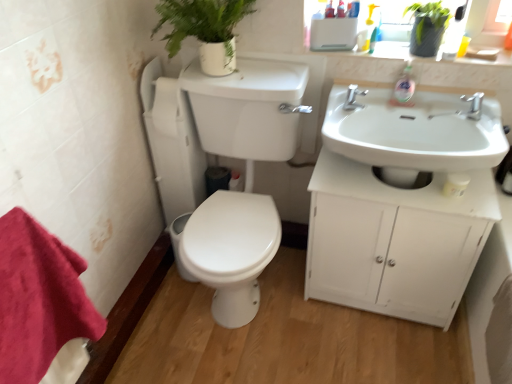
Question: Considering the relative sizes of green matte plant at upper center, which is the 2th plant from right to left, and green matte plant at upper right, the first plant positioned from the right, in the image provided, is green matte plant at upper center, which is the 2th plant from right to left, thinner than green matte plant at upper right, the first plant positioned from the right,?

Choices:
 (A) no
 (B) yes

Answer: (A)

Question: Is green matte plant at upper center, which is the 2th plant from right to left, to the right of green matte plant at upper right, the first plant positioned from the right, from the viewer's perspective?

Choices:
 (A) yes
 (B) no

Answer: (B)

Question: Are green matte plant at upper center, the 1th plant when ordered from left to right, and green matte plant at upper right, the first plant positioned from the right, beside each other?

Choices:
 (A) no
 (B) yes

Answer: (A)

Question: Is green matte plant at upper center, the 1th plant when ordered from left to right, far away from green matte plant at upper right, the first plant positioned from the right?

Choices:
 (A) no
 (B) yes

Answer: (A)

Question: From a real-world perspective, is green matte plant at upper center, which is the 2th plant from right to left, under green matte plant at upper right, the first plant positioned from the right?

Choices:
 (A) yes
 (B) no

Answer: (A)

Question: Is white glossy toilet at center-left to the left or to the right of red cotton towel at lower left in the image?

Choices:
 (A) left
 (B) right

Answer: (B)

Question: Considering the positions of white glossy toilet at center-left and red cotton towel at lower left in the image, is white glossy toilet at center-left bigger or smaller than red cotton towel at lower left?

Choices:
 (A) big
 (B) small

Answer: (A)

Question: From the image's perspective, is white glossy toilet at center-left located above or below red cotton towel at lower left?

Choices:
 (A) above
 (B) below

Answer: (A)

Question: Considering their positions, is white glossy toilet at center-left located in front of or behind red cotton towel at lower left?

Choices:
 (A) front
 (B) behind

Answer: (B)

Question: From a real-world perspective, relative to silver metallic faucet at upper right, acting as the 1th tap starting from the right, is green matte plant at upper center, the 1th plant when ordered from left to right, vertically above or below?

Choices:
 (A) above
 (B) below

Answer: (A)

Question: In terms of height, does green matte plant at upper center, the 1th plant when ordered from left to right, look taller or shorter compared to silver metallic faucet at upper right, the second tap viewed from the left?

Choices:
 (A) tall
 (B) short

Answer: (A)

Question: In the image, is green matte plant at upper center, which is the 2th plant from right to left, on the left side or the right side of silver metallic faucet at upper right, the second tap viewed from the left?

Choices:
 (A) right
 (B) left

Answer: (B)

Question: Is point (203, 16) closer or farther from the camera than point (474, 96)?

Choices:
 (A) closer
 (B) farther

Answer: (B)

Question: Choose the correct answer: Is silver metallic faucet at upper right, the second tap viewed from the left, inside silver metallic tap at upper center, which ranks as the first tap in left-to-right order, or outside it?

Choices:
 (A) inside
 (B) outside

Answer: (B)

Question: Based on their sizes in the image, would you say silver metallic faucet at upper right, acting as the 1th tap starting from the right, is bigger or smaller than silver metallic tap at upper center, which ranks as the first tap in left-to-right order?

Choices:
 (A) big
 (B) small

Answer: (B)